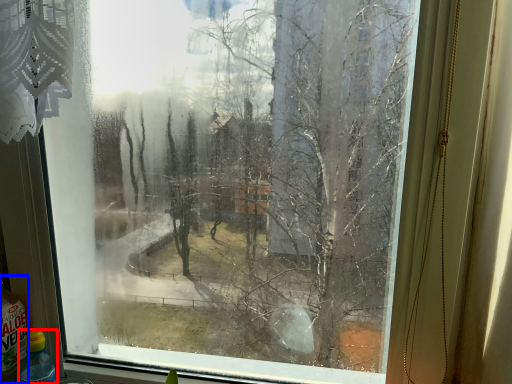
Question: Among these objects, which one is nearest to the camera, bottle (highlighted by a red box) or bottle (highlighted by a blue box)?

Choices:
 (A) bottle
 (B) bottle

Answer: (B)